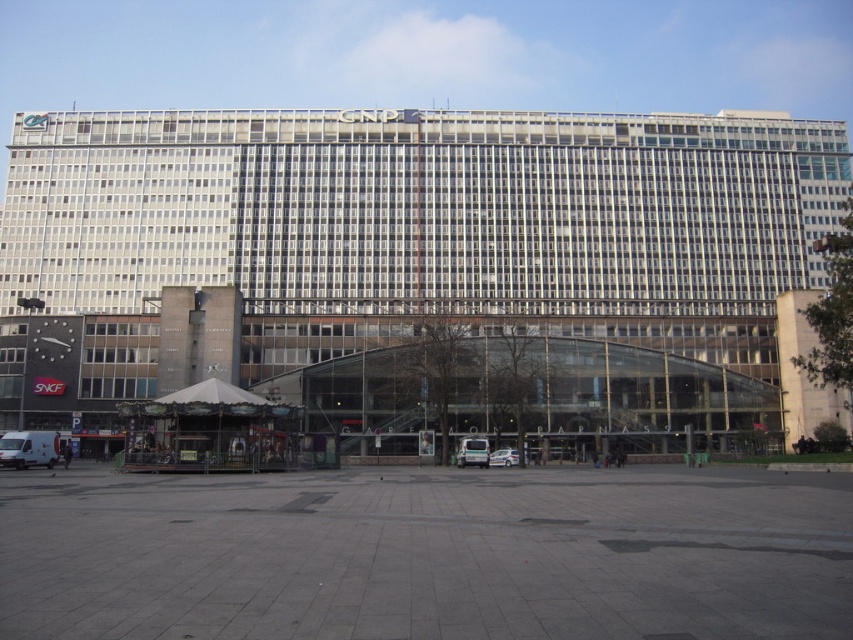
Based on the photo, you are standing at the entrance of the GARE DARNAUD transit station and want to reach the CNP building. According to the image, which direction should you move from the gray concrete plaza at center to head towards the CNP building?

The CNP building is located above the gray concrete plaza at center, so you should move upward from the gray concrete plaza at center to reach it.

You are a delivery driver arriving at Gare dArnaud station. You need to park your white matte van at lower left close to the gray concrete plaza at center for unloading. Given that the parking spot you choose is 5 meters away from the plaza, will you be able to park the van within 5 meters of the plaza?

The gray concrete plaza at center and white matte van at lower left are 56.59 meters apart from each other. Since the parking spot is only 5 meters away from the plaza, you can park the van within that distance.